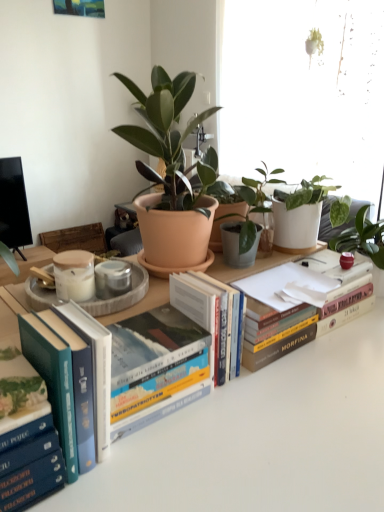
Question: Should I look upward or downward to see matte terracotta pot at center?

Choices:
 (A) down
 (B) up

Answer: (B)

Question: In which direction should I rotate to look at hardcover book at center, positioned as the third book in left-to-right order?

Choices:
 (A) left
 (B) right

Answer: (A)

Question: Is hardcover book at center, the third book from the right, touching hardcover book at center, placed as the first book when sorted from right to left?

Choices:
 (A) no
 (B) yes

Answer: (A)

Question: Is hardcover book at center, positioned as the third book in left-to-right order, further to the viewer compared to hardcover book at center, placed as the first book when sorted from right to left?

Choices:
 (A) yes
 (B) no

Answer: (B)

Question: From a real-world perspective, is hardcover book at center, the third book from the right, physically below hardcover book at center, placed as the 5th book when sorted from left to right?

Choices:
 (A) yes
 (B) no

Answer: (B)

Question: Can you confirm if hardcover book at center, the third book from the right, is smaller than hardcover book at center, placed as the first book when sorted from right to left?

Choices:
 (A) no
 (B) yes

Answer: (B)

Question: Does hardcover book at center, the third book from the right, have a lesser width compared to hardcover book at center, placed as the 5th book when sorted from left to right?

Choices:
 (A) yes
 (B) no

Answer: (B)

Question: Does hardcover book at center, the third book from the right, turn towards hardcover book at center, placed as the 5th book when sorted from left to right?

Choices:
 (A) yes
 (B) no

Answer: (B)

Question: Is hardcover books at left, arranged as the 2th book when viewed from the left, in contact with hardcover book at center, which is the 2th book from right to left?

Choices:
 (A) yes
 (B) no

Answer: (B)

Question: Is hardcover books at left, arranged as the 2th book when viewed from the left, shorter than hardcover book at center, placed as the 4th book when sorted from left to right?

Choices:
 (A) yes
 (B) no

Answer: (B)

Question: Considering the relative positions of hardcover books at left, which appears as the fourth book when viewed from the right, and hardcover book at center, placed as the 4th book when sorted from left to right, in the image provided, is hardcover books at left, which appears as the fourth book when viewed from the right, behind hardcover book at center, placed as the 4th book when sorted from left to right,?

Choices:
 (A) yes
 (B) no

Answer: (B)

Question: Are hardcover books at left, which appears as the fourth book when viewed from the right, and hardcover book at center, placed as the 4th book when sorted from left to right, far apart?

Choices:
 (A) no
 (B) yes

Answer: (A)

Question: From a real-world perspective, does hardcover books at left, arranged as the 2th book when viewed from the left, sit lower than hardcover book at center, which is the 2th book from right to left?

Choices:
 (A) yes
 (B) no

Answer: (B)

Question: Is hardcover books at left, arranged as the 2th book when viewed from the left, positioned with its back to hardcover book at center, placed as the 4th book when sorted from left to right?

Choices:
 (A) no
 (B) yes

Answer: (A)

Question: Is the position of hardcover book at center, placed as the 4th book when sorted from left to right, less distant than that of matte terracotta pot at center?

Choices:
 (A) no
 (B) yes

Answer: (A)